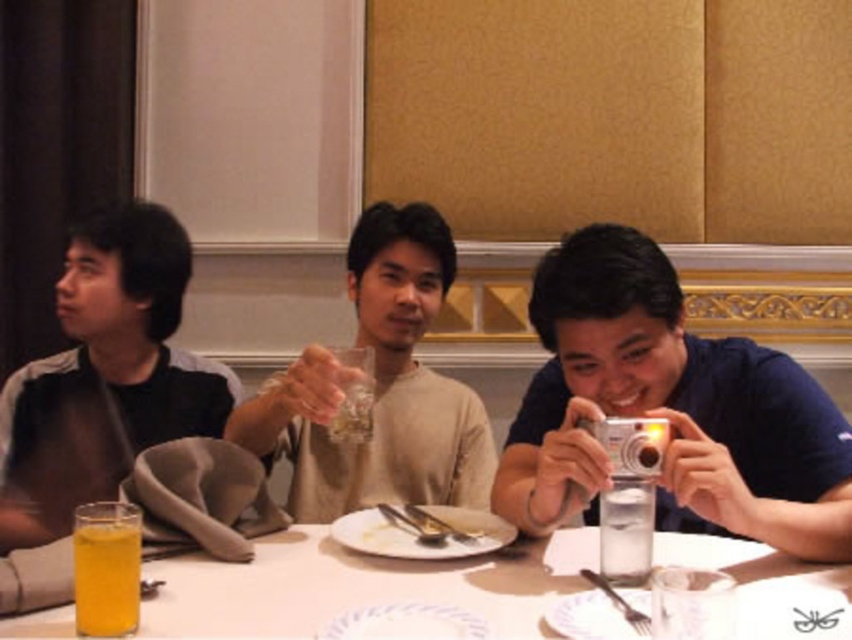
You are a photographer at the dining table and want to take a photo of the silver metallic camera at right and the translucent yellow liquid at lower left. Which object is taller?

The silver metallic camera at right is much taller than the translucent yellow liquid at lower left.

From the picture: You are a waiter at the restaurant and need to deliver a dessert plate to the center of the table. There is a translucent yellow liquid at lower left. Where should you place the dessert plate to avoid spilling the liquid?

The dessert plate should be placed away from the translucent yellow liquid at lower left, which is located at point (106, 568). Since the liquid is at the lower left, placing the dessert plate in the center of the table would avoid it.

You are a photographer who wants to take a picture of the dining table. You have a silver metallic camera at right and a translucent yellow liquid at lower left. Which object should you use to capture the photo?

The silver metallic camera at right should be used to capture the photo since it is a camera, which is designed for taking pictures, while the translucent yellow liquid at lower left is likely a beverage and not a camera.